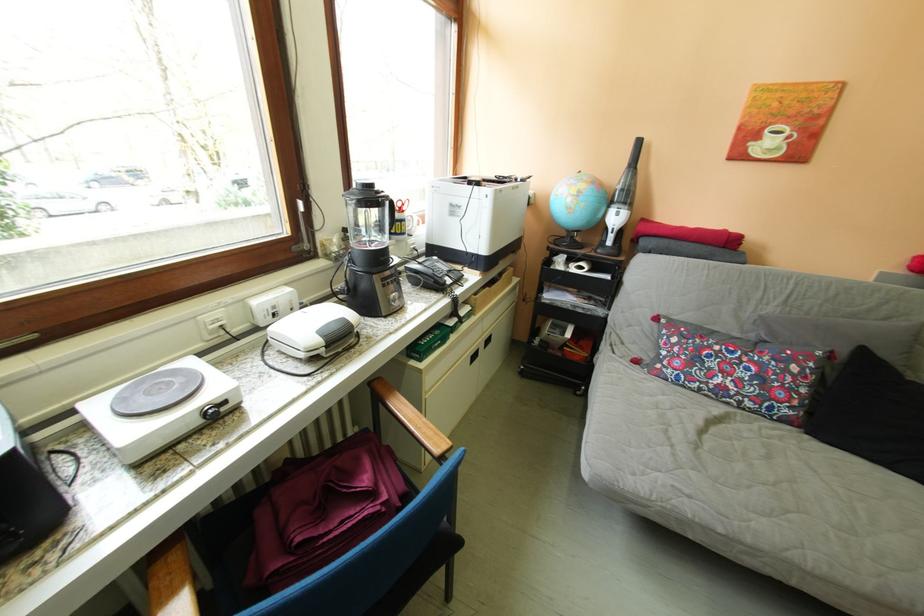
Where is `vacuum cleaner handle`? The image size is (924, 616). vacuum cleaner handle is located at coordinates (624, 241).